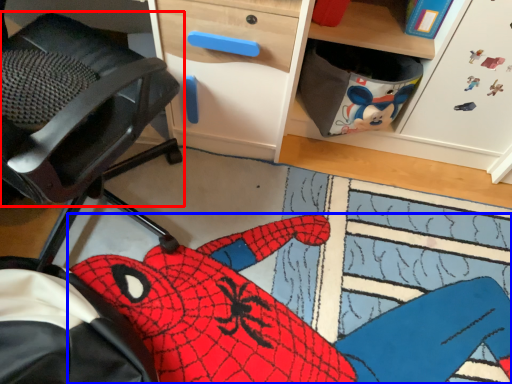
Question: Which point is closer to the camera, chair (highlighted by a red box) or animal (highlighted by a blue box)?

Choices:
 (A) chair
 (B) animal

Answer: (A)